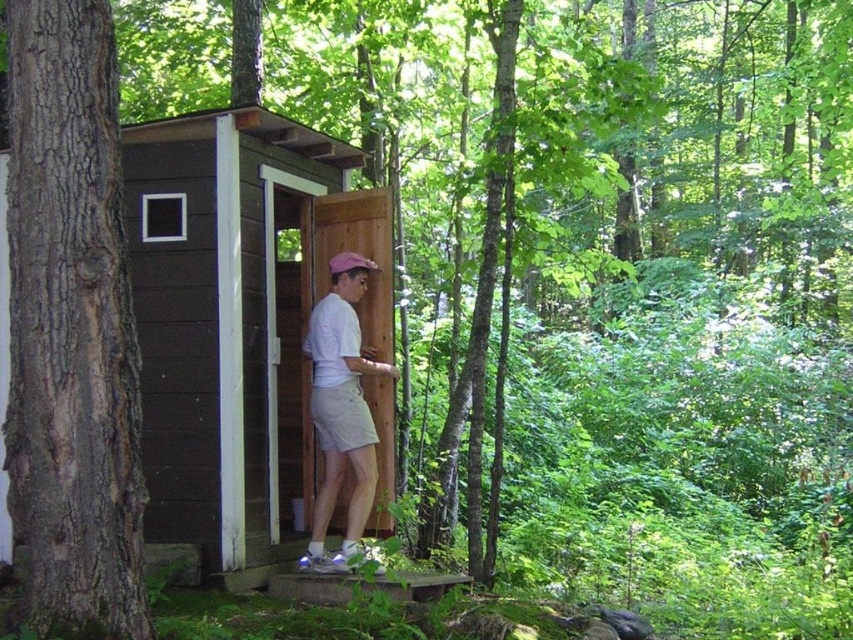
Question: Does brown wood cabin at center have a smaller size compared to pink fabric baseball cap at center?

Choices:
 (A) yes
 (B) no

Answer: (B)

Question: Does brown wood cabin at center come in front of pink fabric baseball cap at center?

Choices:
 (A) yes
 (B) no

Answer: (A)

Question: Which object is closer to the camera taking this photo?

Choices:
 (A) grayish-brown bark tree trunk at left
 (B) brown wood cabin at center
 (C) white matte shorts at center

Answer: (A)

Question: Which of the following is the closest to the observer?

Choices:
 (A) (323, 508)
 (B) (310, 147)
 (C) (349, 268)

Answer: (A)

Question: Estimate the real-world distances between objects in this image. Which object is farther from the white matte shorts at center?

Choices:
 (A) grayish-brown bark tree trunk at left
 (B) brown wood cabin at center
 (C) pink fabric baseball cap at center

Answer: (A)

Question: Does brown wood cabin at center have a lesser width compared to grayish-brown bark tree trunk at left?

Choices:
 (A) yes
 (B) no

Answer: (B)